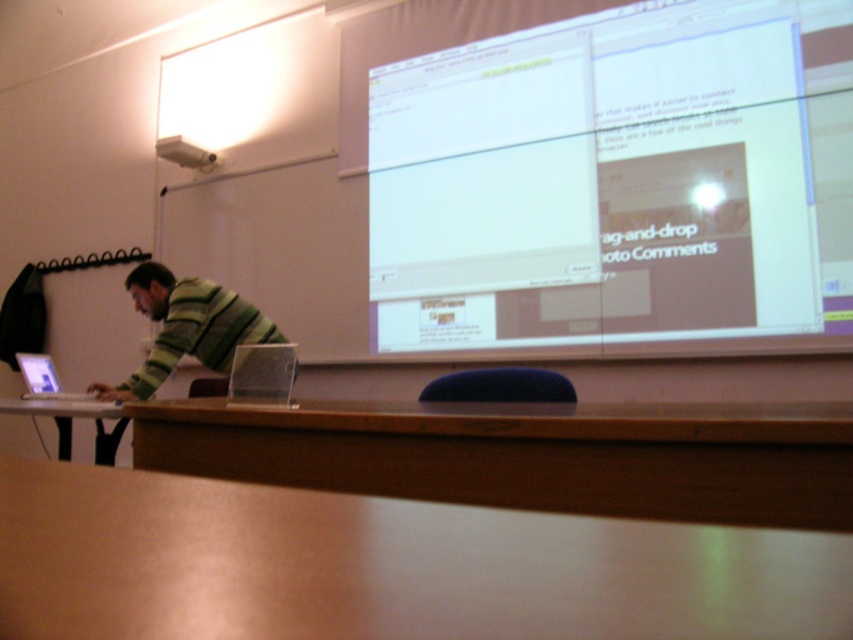
You are standing in the classroom and want to view the projection screen clearly. Considering your height is 5 feet 6 inches, can you see the white glossy projection screen at upper center without needing to stand on something?

The white glossy projection screen at upper center is 8.40 feet away from viewer. Since the distance is measured from the viewer to the screen, your height of 5 feet 6 inches does not affect the horizontal distance. You can view it clearly without needing to stand on something as the distance is sufficient for clear viewing.

You are setting up a presentation and need to know which object is taller between the silver metallic laptop at left and the white plastic projector at upper center. Can you tell me which one is taller?

The silver metallic laptop at left is taller than the white plastic projector at upper center according to the description.